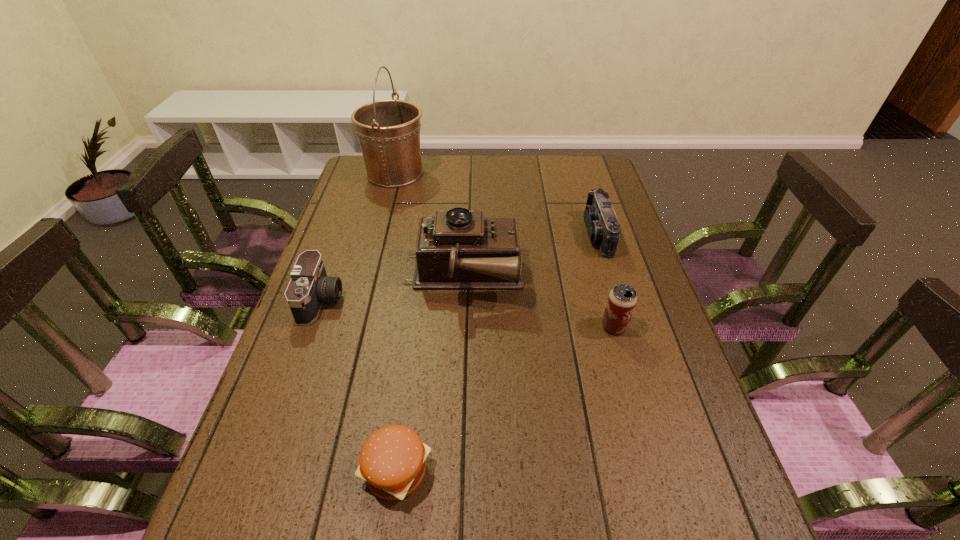
Identify the location of the tallest object. (388, 131).

Find the location of `bucket`. bucket is located at coordinates (388, 131).

What are the coordinates of `the fifth shortest object` in the screenshot? It's located at (459, 249).

I want to click on beer can, so click(x=622, y=299).

Where is `camcorder`? This screenshot has width=960, height=540. camcorder is located at coordinates (601, 222).

What are the coordinates of `camera` in the screenshot? It's located at (309, 287).

Locate an element on the screen. the nearest object is located at coordinates (392, 460).

The image size is (960, 540). Identify the location of hamburger. (392, 460).

In order to click on free space located 0.300m on the front of the farthest object in this screenshot , I will do `click(375, 250)`.

The height and width of the screenshot is (540, 960). Identify the location of vacant space located on the horn of the phonograph_record. [x=635, y=276].